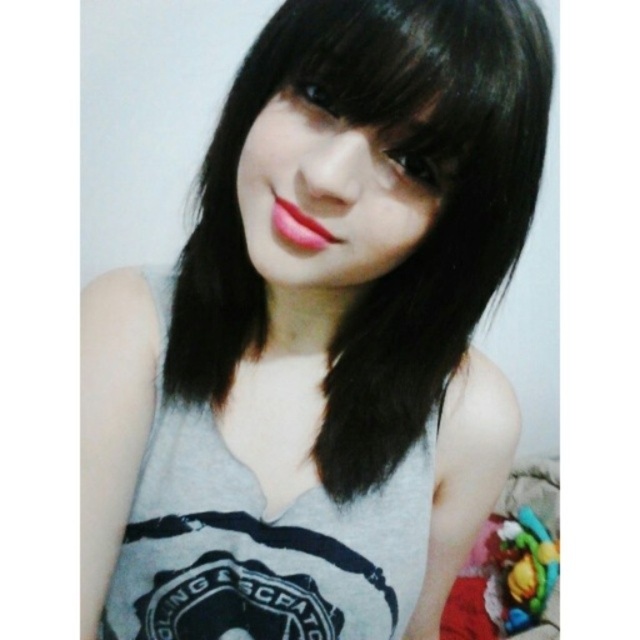
Is gray cotton tank top at center shorter than matte black hair at center?

In fact, gray cotton tank top at center may be taller than matte black hair at center.

Who is more forward, (401, 602) or (291, 102)?

Positioned in front is point (291, 102).

The image size is (640, 640). What are the coordinates of `gray cotton tank top at center` in the screenshot? It's located at (260, 545).

Is gray cotton tank top at center above matte pink lipstick at center?

Actually, gray cotton tank top at center is below matte pink lipstick at center.

Does point (349, 570) come in front of point (280, 224)?

No, it is behind (280, 224).

Between point (406, 522) and point (323, 232), which one is positioned in front?

Point (323, 232) is in front.

Locate an element on the screen. Image resolution: width=640 pixels, height=640 pixels. gray cotton tank top at center is located at coordinates (260, 545).

Is matte black hair at center to the left of matte pink lipstick at center from the viewer's perspective?

No, matte black hair at center is not to the left of matte pink lipstick at center.

Who is more forward, [321,148] or [298,236]?

Point [321,148] is more forward.

Where is `matte black hair at center`? Image resolution: width=640 pixels, height=640 pixels. matte black hair at center is located at coordinates (330, 195).